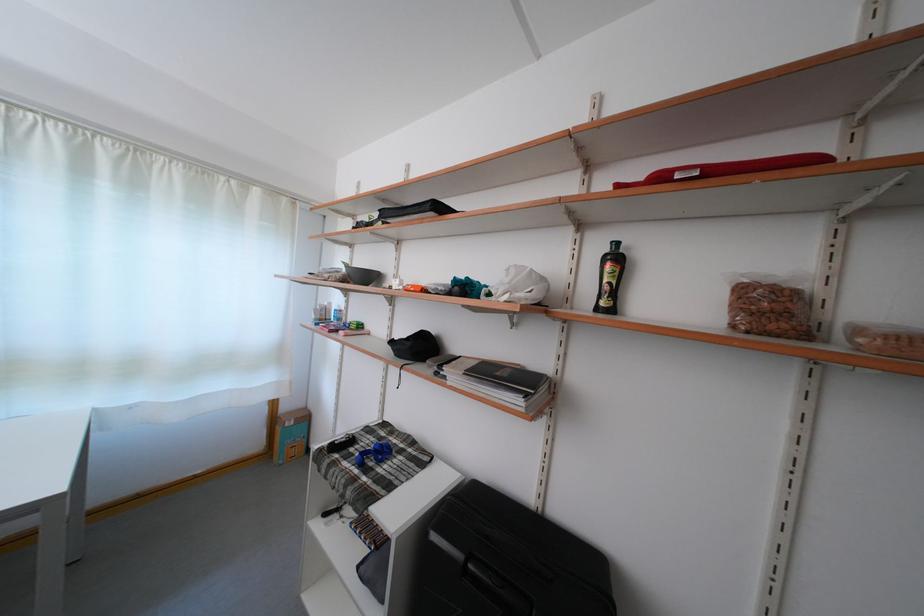
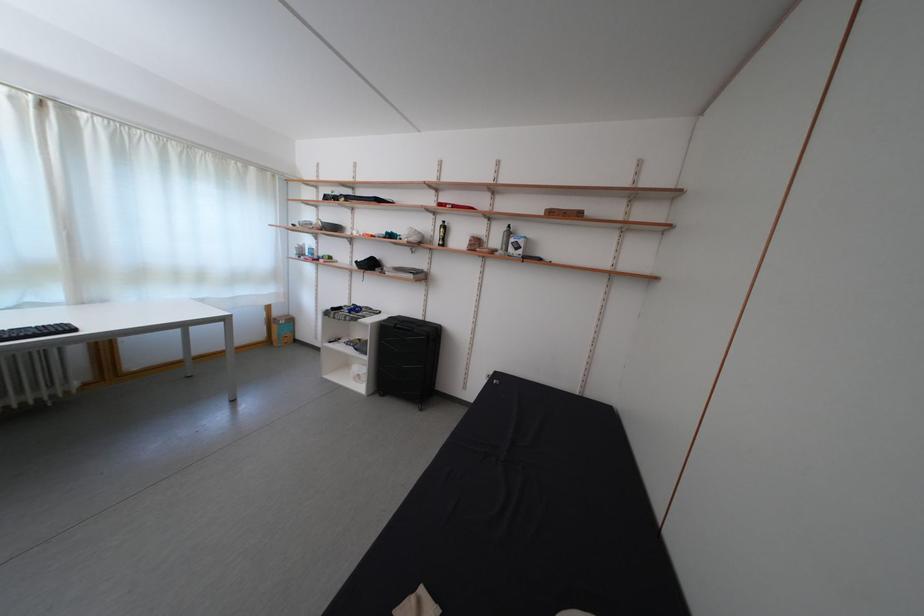
Locate, in the second image, the point that corresponds to pixel 293 415 in the first image.

(285, 320)